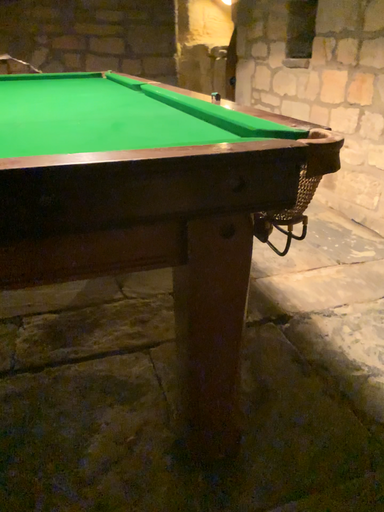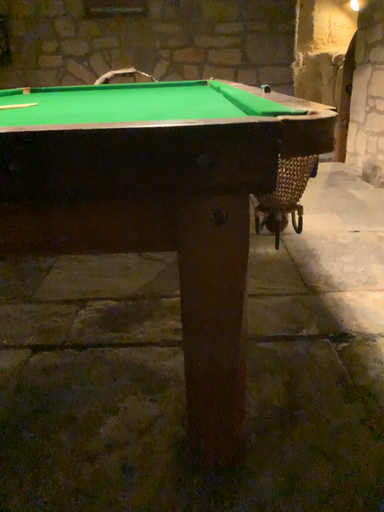
Question: Which way did the camera rotate in the video?

Choices:
 (A) rotated left
 (B) rotated right

Answer: (A)